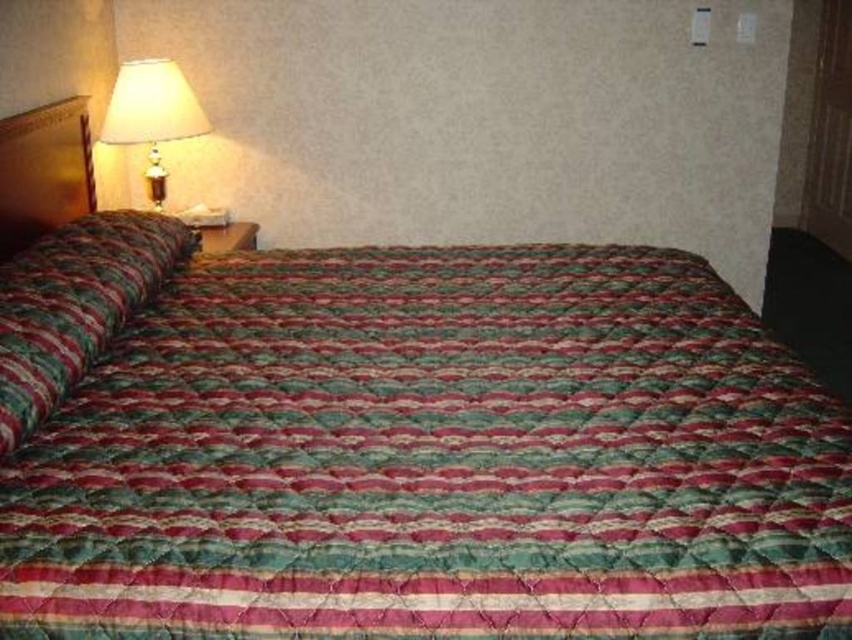
You are a hotel guest who wants to adjust the lamp to read a book. The lamp has a matte cream lampshade at upper left. Where is the textured cotton pillow at left in relation to the lamp?

The textured cotton pillow at left is positioned under the matte cream lampshade at upper left.

You are standing at the foot of the bed and want to move to the nightstand on the right. Which direction should you turn to face the textured cotton pillow at left?

You should turn to your left to face the textured cotton pillow at left, as it is located on the left side of the bed relative to your position at the foot.